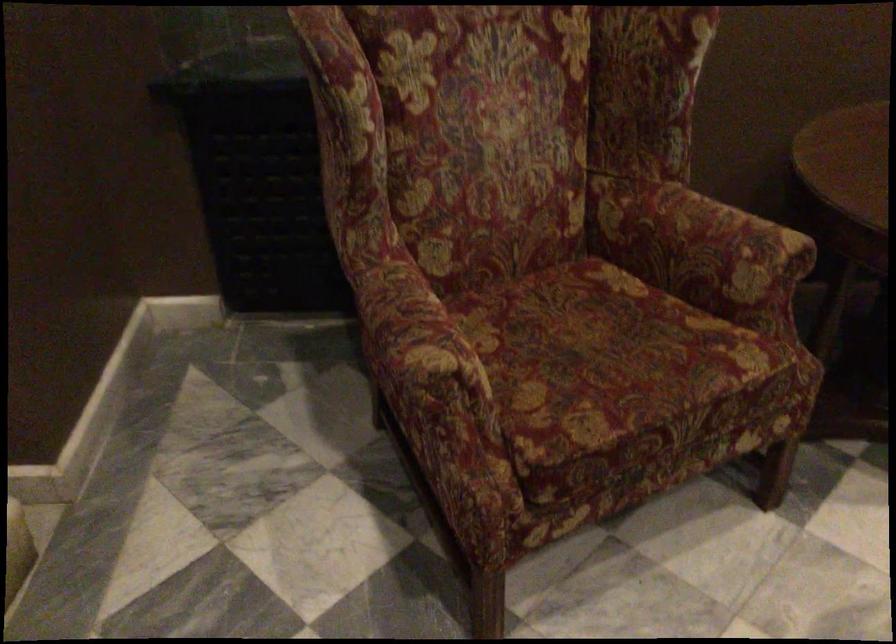
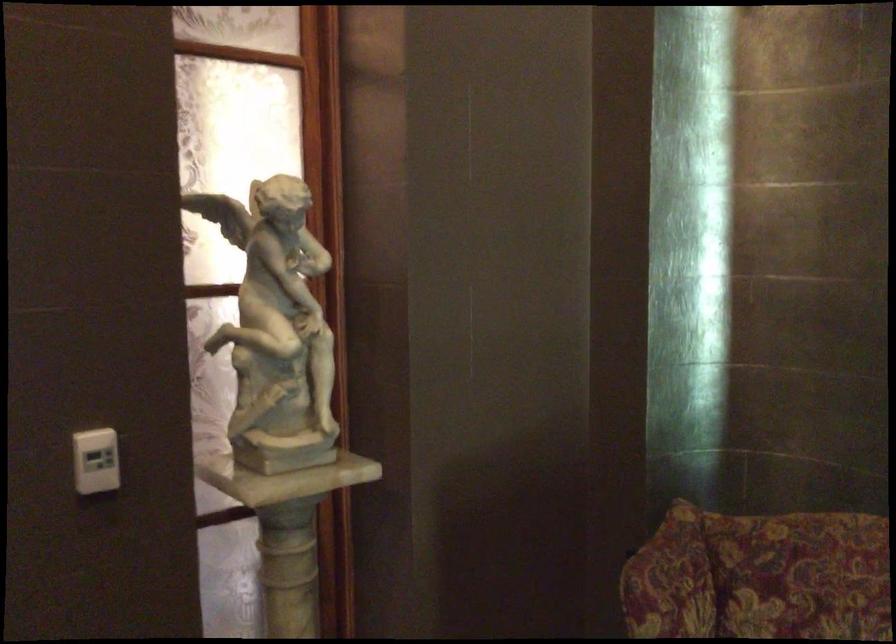
Question: Based on the continuous images, in which direction is the camera rotating? Reply with the corresponding letter.

Choices:
 (A) Left
 (B) Right
 (C) Up
 (D) Down

Answer: (A)